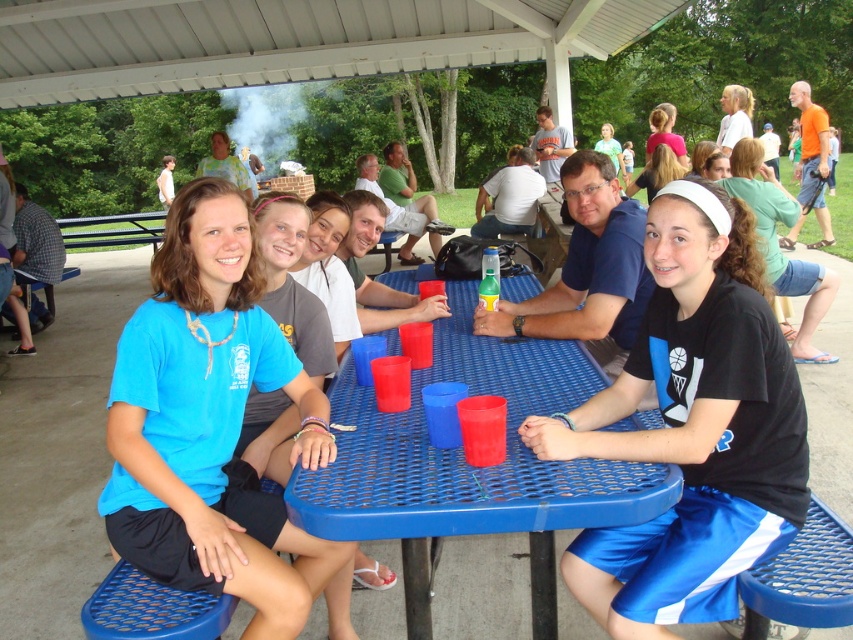
You are taking a photo of the picnic scene and want to focus on both the point at location (x=712, y=477) and the point at (x=207, y=358). Which point is closer to your camera lens?

Point at location (x=712, y=477) is closer to the camera lens than point at (x=207, y=358).